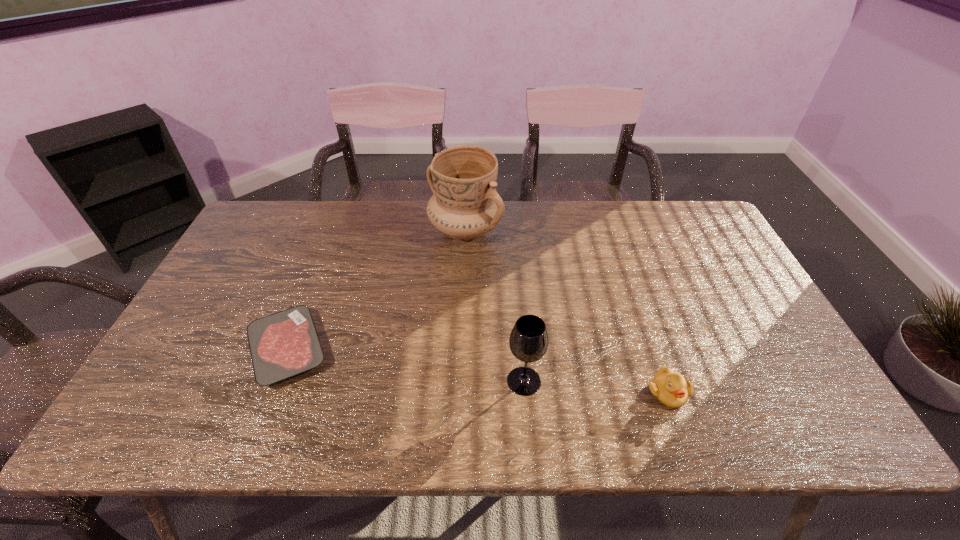
In order to click on blank space that satisfies the following two spatial constraints: 1. on the back side of the leftmost object; 2. on the right side of the pottery in this screenshot , I will do `click(334, 230)`.